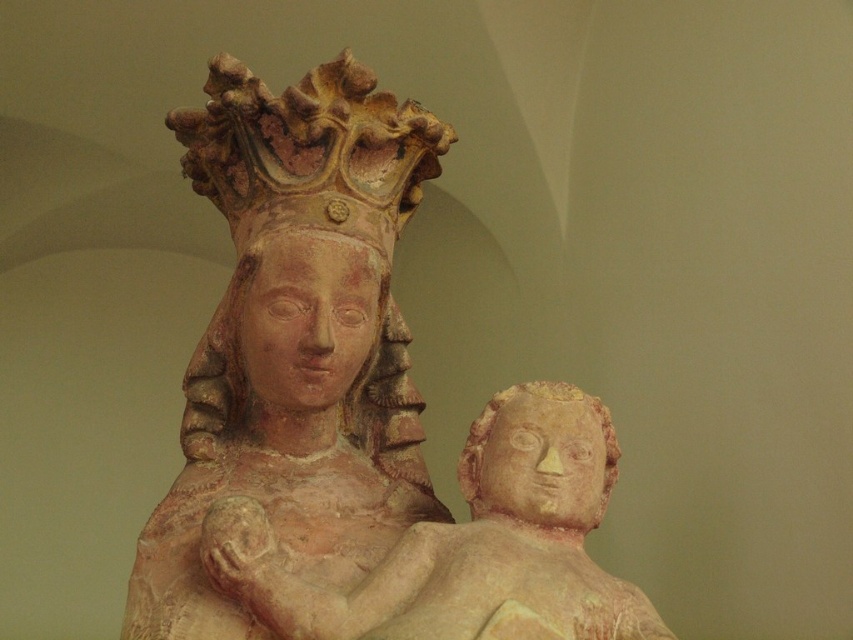
You are an art conservator assessing the statue. You need to determine if the matte stone head at center can be placed on a shelf that is narrower than the matte terracotta statue at center. Can it fit?

The matte terracotta statue at center might be wider than the matte stone head at center, so the shelf might not be wide enough for the statue. The matte stone head at center could potentially fit if it is narrower, but the statue itself may not.

You are an art conservator examining the statue. You notice two parts of the statue that need restoration. The matte terracotta statue at center and the matte stone head at center. According to the spatial arrangement, which part is located to the left?

The matte terracotta statue at center is positioned on the left side of the matte stone head at center, so the matte terracotta statue at center is located to the left.

In the scene shown: You are an art conservator assessing the statue. You need to determine if the matte terracotta statue at center and the matte terracotta baby at lower center can fit on a transport crate that is 1 meter wide. Can both fit side by side?

The matte terracotta statue at center is wider than the matte terracotta baby at lower center. However, without knowing their exact widths, it is impossible to determine if both can fit side by side on a 1 meter wide crate.